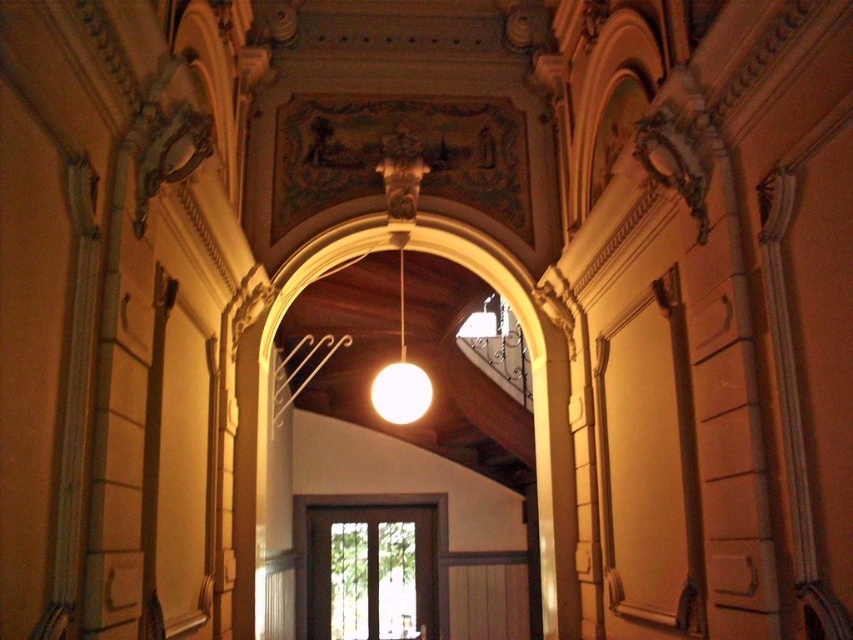
Question: Is the position of matte glass door at center less distant than that of matte white sphere at center?

Choices:
 (A) yes
 (B) no

Answer: (B)

Question: Is matte glass door at center wider than matte white sphere at center?

Choices:
 (A) no
 (B) yes

Answer: (B)

Question: Which object is closer to the camera taking this photo?

Choices:
 (A) matte glass door at center
 (B) matte white sphere at center

Answer: (B)

Question: Can you confirm if matte glass door at center is positioned to the left of matte white sphere at center?

Choices:
 (A) no
 (B) yes

Answer: (B)

Question: Which point is farther to the camera?

Choices:
 (A) matte white sphere at center
 (B) matte glass door at center

Answer: (B)